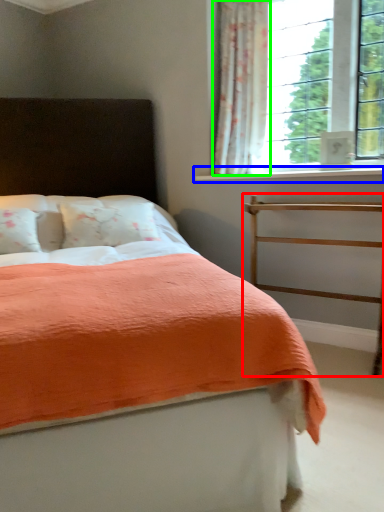
Question: Based on their relative distances, which object is nearer to balustrade (highlighted by a red box)? Choose from window sill (highlighted by a blue box) and curtain (highlighted by a green box).

Choices:
 (A) window sill
 (B) curtain

Answer: (A)